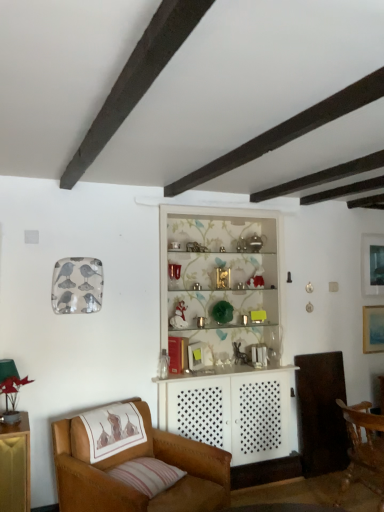
In order to face wooden chair at lower right, which appears as the 2th chair when viewed from the left, should I rotate leftwards or rightwards?

You should rotate right by 24.237 degrees.

Measure the distance between point (148, 467) and camera.

A distance of 8.22 feet exists between point (148, 467) and camera.

What is the approximate width of matte black picture frame at upper right, arranged as the 1th picture frame when viewed from the top?

matte black picture frame at upper right, arranged as the 1th picture frame when viewed from the top, is 3.23 centimeters wide.

The height and width of the screenshot is (512, 384). Describe the element at coordinates (373, 329) in the screenshot. I see `matte blue painting at upper right, the first picture frame positioned from the bottom` at that location.

At what (x,y) coordinates should I click in order to perform the action: click on leather armchair at lower left, the 1th chair viewed from the left. Please return your answer as a coordinate pair (x, y). The height and width of the screenshot is (512, 384). Looking at the image, I should click on (131, 459).

Is wooden chair at lower right, which appears as the 2th chair when viewed from the left, placed right next to matte black picture frame at upper right, arranged as the 1th picture frame when viewed from the top?

wooden chair at lower right, which appears as the 2th chair when viewed from the left, is not next to matte black picture frame at upper right, arranged as the 1th picture frame when viewed from the top, and they're not touching.

Where is `picture frame that is the 2nd one when counting backward from the wooden chair at lower right, which is the 1th chair from right to left`? The image size is (384, 512). picture frame that is the 2nd one when counting backward from the wooden chair at lower right, which is the 1th chair from right to left is located at coordinates [x=372, y=264].

From the image's perspective, which one is positioned higher, wooden chair at lower right, which is the 1th chair from right to left, or matte black picture frame at upper right, arranged as the 1th picture frame when viewed from the top?

matte black picture frame at upper right, arranged as the 1th picture frame when viewed from the top, appears higher in the image.

Would you say wooden chair at lower right, which appears as the 2th chair when viewed from the left, contains matte black picture frame at upper right, arranged as the 1th picture frame when viewed from the top?

That's incorrect, matte black picture frame at upper right, arranged as the 1th picture frame when viewed from the top, is not inside wooden chair at lower right, which appears as the 2th chair when viewed from the left.

Can you confirm if leather armchair at lower left, the 1th chair viewed from the left, is wider than matte black picture frame at upper right, which is the 2th picture frame in bottom-to-top order?

Yes.

From the picture: Can you confirm if leather armchair at lower left, the second chair viewed from the right, is bigger than matte black picture frame at upper right, which is the 2th picture frame in bottom-to-top order?

Yes.

Which is behind, point (74, 473) or point (376, 241)?

The point (376, 241) is farther from the camera.

Is wooden chair at lower right, which is the 1th chair from right to left, facing away from striped fabric pillow at lower left?

Absolutely, wooden chair at lower right, which is the 1th chair from right to left, is directed away from striped fabric pillow at lower left.

Consider the image. From their relative heights in the image, would you say wooden chair at lower right, which is the 1th chair from right to left, is taller or shorter than striped fabric pillow at lower left?

In the image, wooden chair at lower right, which is the 1th chair from right to left, appears to be taller than striped fabric pillow at lower left.

Is wooden chair at lower right, which appears as the 2th chair when viewed from the left, outside of striped fabric pillow at lower left?

Yes, wooden chair at lower right, which appears as the 2th chair when viewed from the left, is outside of striped fabric pillow at lower left.

From a real-world perspective, which object rests below the other?

In real-world perspective, wooden chair at lower right, which appears as the 2th chair when viewed from the left, is lower.

Would you say matte blue painting at upper right, the 2th picture frame when ordered from top to bottom, is inside or outside leather armchair at lower left, the second chair viewed from the right?

matte blue painting at upper right, the 2th picture frame when ordered from top to bottom, lies outside leather armchair at lower left, the second chair viewed from the right.

Considering the positions of objects matte blue painting at upper right, the 2th picture frame when ordered from top to bottom, and leather armchair at lower left, the 1th chair viewed from the left, in the image provided, who is in front, matte blue painting at upper right, the 2th picture frame when ordered from top to bottom, or leather armchair at lower left, the 1th chair viewed from the left,?

leather armchair at lower left, the 1th chair viewed from the left.

Is matte blue painting at upper right, the 2th picture frame when ordered from top to bottom, positioned far away from leather armchair at lower left, the 1th chair viewed from the left?

Yes, matte blue painting at upper right, the 2th picture frame when ordered from top to bottom, and leather armchair at lower left, the 1th chair viewed from the left, are located far from each other.

Measure the distance from leather armchair at lower left, the second chair viewed from the right, to matte blue painting at upper right, the 2th picture frame when ordered from top to bottom.

leather armchair at lower left, the second chair viewed from the right, and matte blue painting at upper right, the 2th picture frame when ordered from top to bottom, are 7.81 feet apart from each other.

Which object is wider, leather armchair at lower left, the second chair viewed from the right, or matte blue painting at upper right, the 2th picture frame when ordered from top to bottom?

leather armchair at lower left, the second chair viewed from the right.

From the image's perspective, is leather armchair at lower left, the 1th chair viewed from the left, under matte blue painting at upper right, the 2th picture frame when ordered from top to bottom?

Correct, leather armchair at lower left, the 1th chair viewed from the left, appears lower than matte blue painting at upper right, the 2th picture frame when ordered from top to bottom, in the image.

The width and height of the screenshot is (384, 512). Find the location of `chair that is the 1st one below the matte blue painting at upper right, the 2th picture frame when ordered from top to bottom (from a real-world perspective)`. chair that is the 1st one below the matte blue painting at upper right, the 2th picture frame when ordered from top to bottom (from a real-world perspective) is located at coordinates (131, 459).

From a real-world perspective, is wooden chair at lower right, which is the 1th chair from right to left, above or below matte blue painting at upper right, the 2th picture frame when ordered from top to bottom?

wooden chair at lower right, which is the 1th chair from right to left, is below matte blue painting at upper right, the 2th picture frame when ordered from top to bottom.

Consider the image. Is wooden chair at lower right, which is the 1th chair from right to left, looking in the opposite direction of matte blue painting at upper right, the first picture frame positioned from the bottom?

No, wooden chair at lower right, which is the 1th chair from right to left, is not facing the opposite direction of matte blue painting at upper right, the first picture frame positioned from the bottom.

Considering the relative sizes of wooden chair at lower right, which is the 1th chair from right to left, and matte blue painting at upper right, the 2th picture frame when ordered from top to bottom, in the image provided, is wooden chair at lower right, which is the 1th chair from right to left, smaller than matte blue painting at upper right, the 2th picture frame when ordered from top to bottom,?

Actually, wooden chair at lower right, which is the 1th chair from right to left, might be larger than matte blue painting at upper right, the 2th picture frame when ordered from top to bottom.

In the image, is wooden chair at lower right, which appears as the 2th chair when viewed from the left, positioned in front of or behind matte blue painting at upper right, the 2th picture frame when ordered from top to bottom?

Visually, wooden chair at lower right, which appears as the 2th chair when viewed from the left, is located in front of matte blue painting at upper right, the 2th picture frame when ordered from top to bottom.

Does leather armchair at lower left, the 1th chair viewed from the left, have a larger size compared to striped fabric pillow at lower left?

Yes.

Where is `chair that is the 1st object located below the striped fabric pillow at lower left (from the image's perspective)`? This screenshot has height=512, width=384. chair that is the 1st object located below the striped fabric pillow at lower left (from the image's perspective) is located at coordinates (131, 459).

Which of these two, leather armchair at lower left, the second chair viewed from the right, or striped fabric pillow at lower left, stands taller?

Standing taller between the two is leather armchair at lower left, the second chair viewed from the right.

Would you say leather armchair at lower left, the second chair viewed from the right, is inside or outside striped fabric pillow at lower left?

leather armchair at lower left, the second chair viewed from the right, is outside striped fabric pillow at lower left.

You are a GUI agent. You are given a task and a screenshot of the screen. Output one action in this format:
    pyautogui.click(x=<x>, y=<y>)
    Task: Click on the 1st chair in front of the matte black picture frame at upper right, arranged as the 1th picture frame when viewed from the top, counting from the anchor's position
    
    Given the screenshot: What is the action you would take?
    pyautogui.click(x=364, y=445)

Where is `chair that is the 1st object directly below the matte black picture frame at upper right, arranged as the 1th picture frame when viewed from the top (from a real-world perspective)`? chair that is the 1st object directly below the matte black picture frame at upper right, arranged as the 1th picture frame when viewed from the top (from a real-world perspective) is located at coordinates (131, 459).

From the image, which object appears to be farther from striped fabric pillow at lower left, wooden chair at lower right, which is the 1th chair from right to left, or matte blue painting at upper right, the first picture frame positioned from the bottom?

matte blue painting at upper right, the first picture frame positioned from the bottom, is further to striped fabric pillow at lower left.

Looking at the image, which one is located closer to striped fabric pillow at lower left, leather armchair at lower left, the second chair viewed from the right, or matte black picture frame at upper right, which is the 2th picture frame in bottom-to-top order?

leather armchair at lower left, the second chair viewed from the right, is closer to striped fabric pillow at lower left.

In the scene shown: When comparing their distances from wooden chair at lower right, which appears as the 2th chair when viewed from the left, does leather armchair at lower left, the second chair viewed from the right, or matte blue painting at upper right, the 2th picture frame when ordered from top to bottom, seem closer?

matte blue painting at upper right, the 2th picture frame when ordered from top to bottom, is closer to wooden chair at lower right, which appears as the 2th chair when viewed from the left.

When comparing their distances from wooden chair at lower right, which appears as the 2th chair when viewed from the left, does leather armchair at lower left, the 1th chair viewed from the left, or matte black picture frame at upper right, arranged as the 1th picture frame when viewed from the top, seem further?

matte black picture frame at upper right, arranged as the 1th picture frame when viewed from the top.

When comparing their distances from striped fabric pillow at lower left, does matte black picture frame at upper right, which is the 2th picture frame in bottom-to-top order, or matte blue painting at upper right, the first picture frame positioned from the bottom, seem closer?

matte blue painting at upper right, the first picture frame positioned from the bottom, is positioned closer to the anchor striped fabric pillow at lower left.

Based on their spatial positions, is matte black picture frame at upper right, which is the 2th picture frame in bottom-to-top order, or wooden chair at lower right, which appears as the 2th chair when viewed from the left, closer to leather armchair at lower left, the 1th chair viewed from the left?

Based on the image, wooden chair at lower right, which appears as the 2th chair when viewed from the left, appears to be nearer to leather armchair at lower left, the 1th chair viewed from the left.

Based on the photo, from the image, which object appears to be nearer to striped fabric pillow at lower left, matte black picture frame at upper right, arranged as the 1th picture frame when viewed from the top, or wooden chair at lower right, which appears as the 2th chair when viewed from the left?

wooden chair at lower right, which appears as the 2th chair when viewed from the left, is positioned closer to the anchor striped fabric pillow at lower left.

When comparing their distances from leather armchair at lower left, the 1th chair viewed from the left, does matte black picture frame at upper right, which is the 2th picture frame in bottom-to-top order, or matte blue painting at upper right, the first picture frame positioned from the bottom, seem further?

matte black picture frame at upper right, which is the 2th picture frame in bottom-to-top order, is positioned further to the anchor leather armchair at lower left, the 1th chair viewed from the left.

Locate an element on the screen. pillow situated between leather armchair at lower left, the 1th chair viewed from the left, and matte black picture frame at upper right, which is the 2th picture frame in bottom-to-top order, from left to right is located at coordinates (x=147, y=475).

Image resolution: width=384 pixels, height=512 pixels. I want to click on chair between leather armchair at lower left, the 1th chair viewed from the left, and matte black picture frame at upper right, which is the 2th picture frame in bottom-to-top order, from front to back, so click(x=364, y=445).

Find the location of a particular element. This screenshot has height=512, width=384. picture frame between striped fabric pillow at lower left and matte black picture frame at upper right, arranged as the 1th picture frame when viewed from the top is located at coordinates (373, 329).

Identify the location of pillow between leather armchair at lower left, the second chair viewed from the right, and wooden chair at lower right, which is the 1th chair from right to left, from left to right. The width and height of the screenshot is (384, 512). (147, 475).